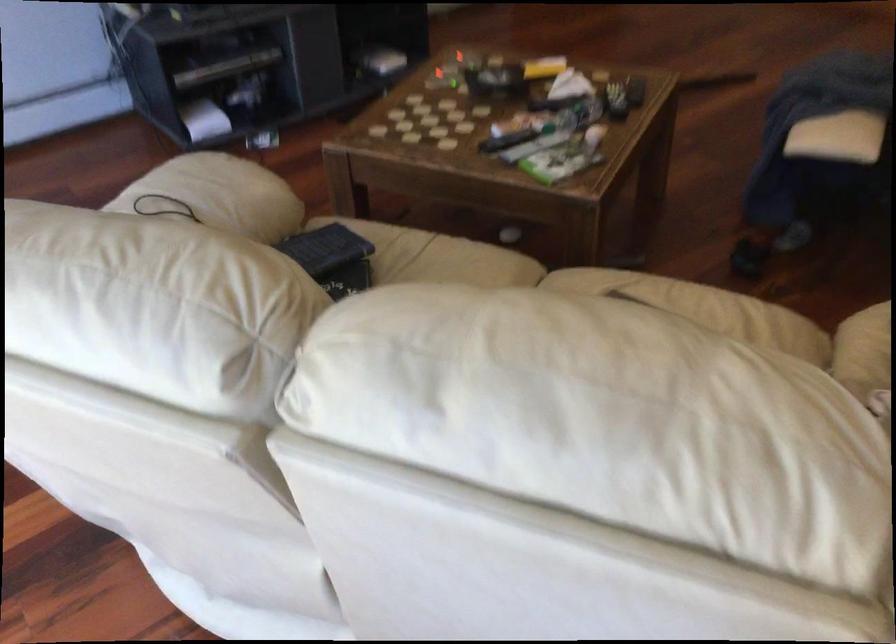
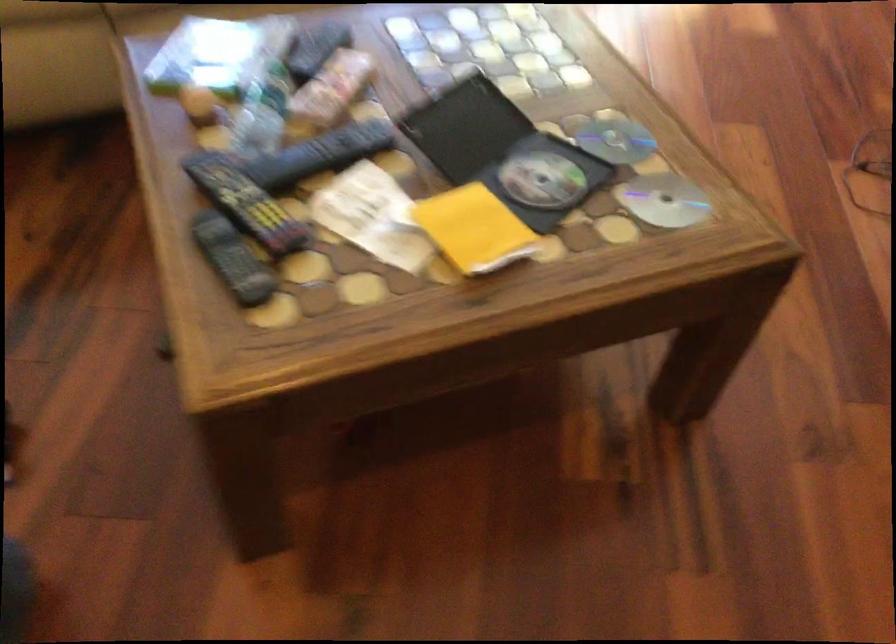
Find the pixel in the second image that matches the point at 616,90 in the first image.

(245, 202)